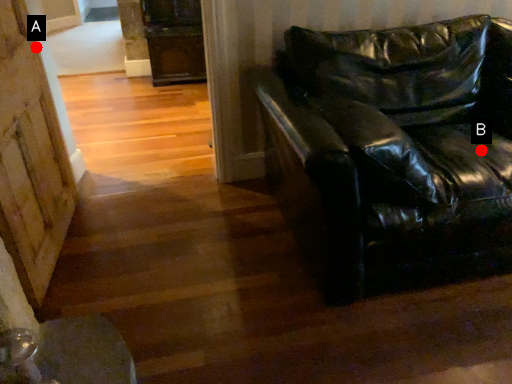
Question: Two points are circled on the image, labeled by A and B beside each circle. Which point is closer to the camera?

Choices:
 (A) A is closer
 (B) B is closer

Answer: (B)